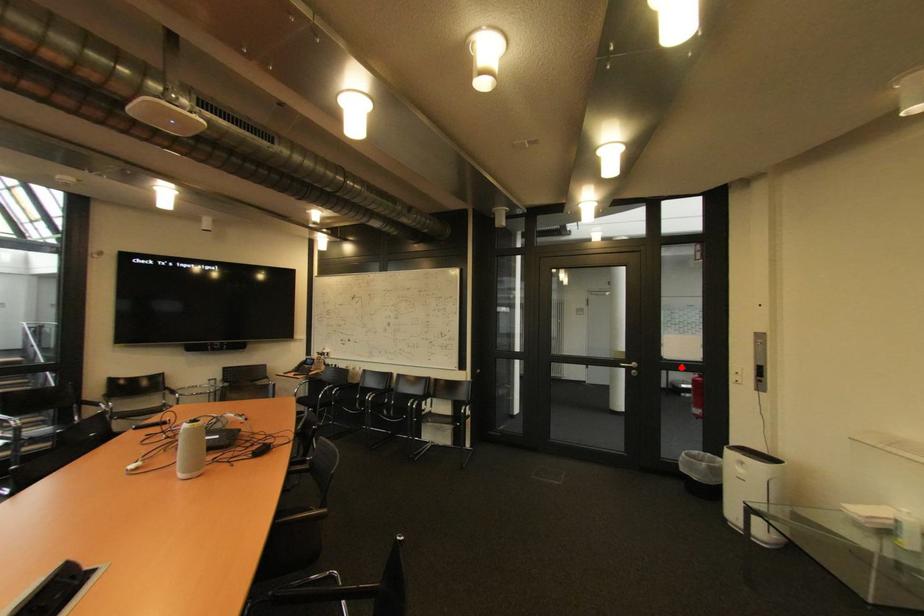
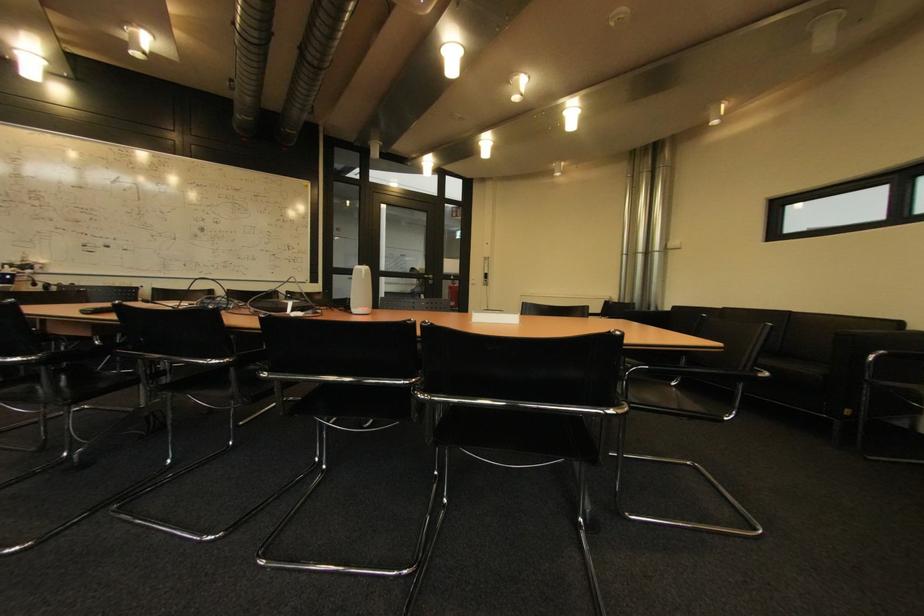
Find the pixel in the second image that matches the highlighted location in the first image.

(456, 278)